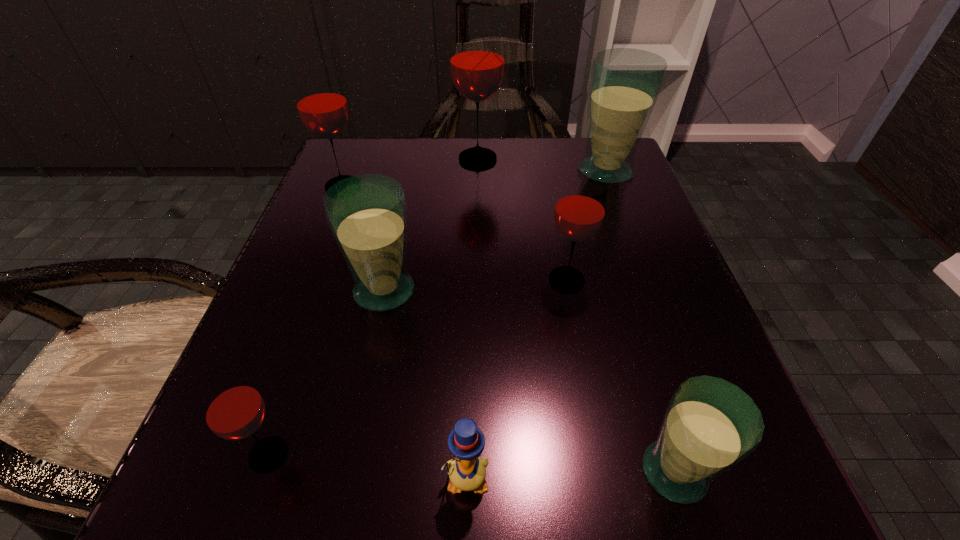
Where is `object that is at the far left corner`? This screenshot has width=960, height=540. object that is at the far left corner is located at coordinates (320, 99).

Where is `object at the near left corner`? The height and width of the screenshot is (540, 960). object at the near left corner is located at coordinates (233, 409).

What are the coordinates of `object present at the far right corner` in the screenshot? It's located at (624, 85).

Identify the location of object present at the near right corner. (710, 425).

This screenshot has height=540, width=960. I want to click on vacant area at the far edge of the desktop, so click(427, 162).

In the image, there is a desktop. Where is `vacant space at the left edge`? Image resolution: width=960 pixels, height=540 pixels. vacant space at the left edge is located at coordinates (329, 272).

The width and height of the screenshot is (960, 540). Find the location of `vacant area at the right edge`. vacant area at the right edge is located at coordinates 607,271.

Identify the location of vacant area at the far left corner. Image resolution: width=960 pixels, height=540 pixels. (363, 139).

Identify the location of vacant area at the near left corner of the desktop. (206, 485).

This screenshot has width=960, height=540. I want to click on free spot between the third smallest red glass and the rightmost red glass, so click(x=455, y=233).